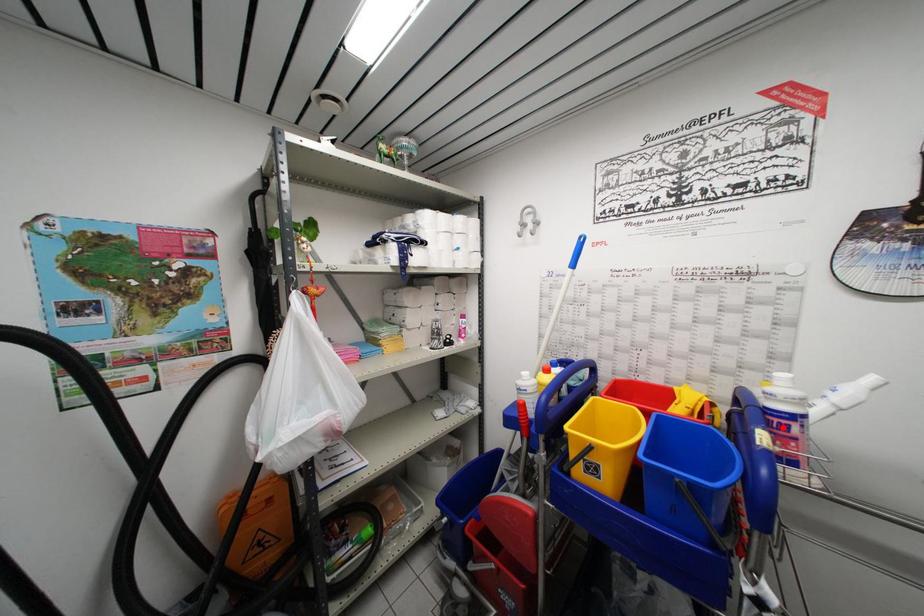
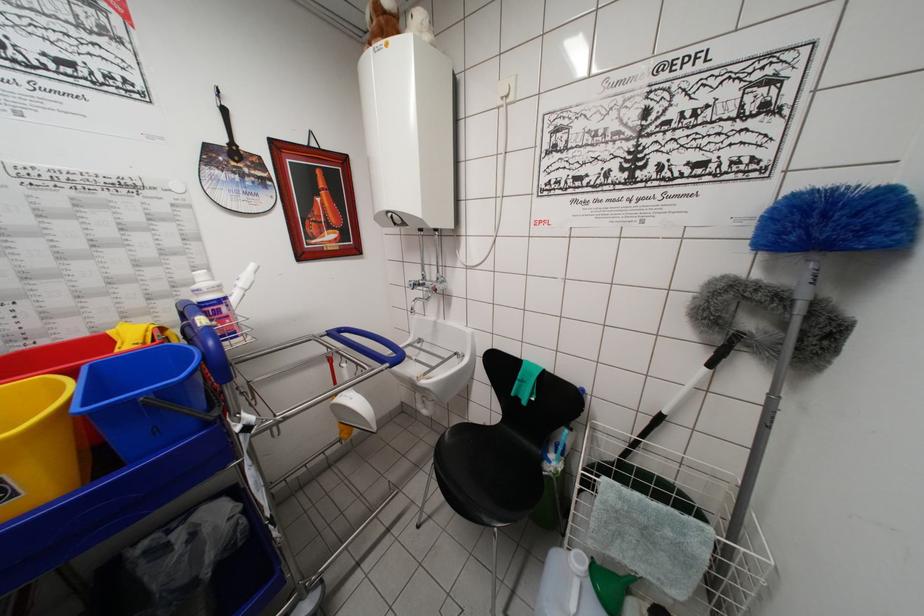
The point at the highlighted location is marked in the first image. Where is the corresponding point in the second image?

(215, 315)